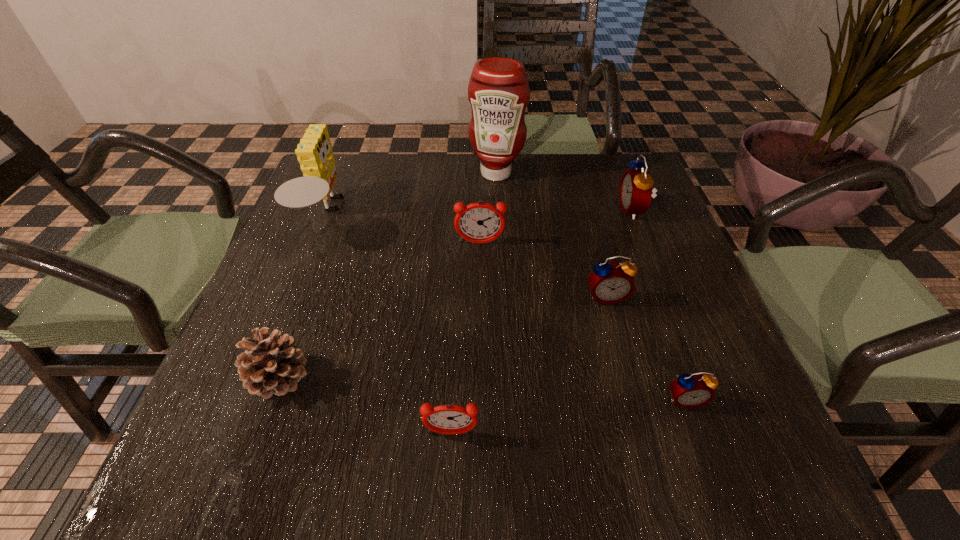
You are a GUI agent. You are given a task and a screenshot of the screen. Output one action in this format:
    pyautogui.click(x=<x>, y=<y>)
    Task: Click on the object that stands as the seventh closest to the leftmost red alarm clock
    The height and width of the screenshot is (540, 960).
    Given the screenshot: What is the action you would take?
    pyautogui.click(x=314, y=152)

Identify the location of the third closest alarm clock to the second nearest alarm clock. The width and height of the screenshot is (960, 540). (479, 222).

The image size is (960, 540). Identify the location of alarm clock object that ranks as the third closest to the fourth nearest alarm clock. (449, 419).

The height and width of the screenshot is (540, 960). Find the location of `red alarm clock that is the closest to the smallest red alarm clock`. red alarm clock that is the closest to the smallest red alarm clock is located at coordinates (610, 283).

Identify which red alarm clock is the third closest to the sponge. Please provide its 2D coordinates. Your answer should be formatted as a tuple, i.e. [(x, y)], where the tuple contains the x and y coordinates of a point satisfying the conditions above.

[(694, 390)]

Locate an element on the screen. The width and height of the screenshot is (960, 540). free spot that satisfies the following two spatial constraints: 1. on the front-facing side of the biggest red alarm clock; 2. on the front-facing side of the bigger reddish-pink alarm clock is located at coordinates (646, 244).

Identify the location of vacant area that satisfies the following two spatial constraints: 1. on the front-facing side of the farthest red alarm clock; 2. on the front-facing side of the bigger reddish-pink alarm clock. (646, 244).